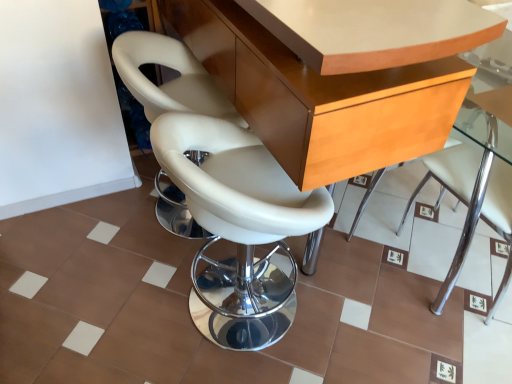
Find the location of a particular element. The width and height of the screenshot is (512, 384). free point below white leather chair at center, the 2th chair in the left-to-right sequence (from a real-world perspective) is located at coordinates (232, 324).